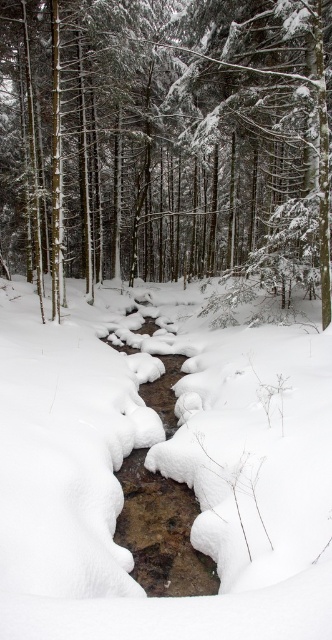
Question: In this image, where is white fluffy snow at center located relative to slick ice stream at center?

Choices:
 (A) left
 (B) right

Answer: (A)

Question: Can you confirm if snow-covered pine tree at center is bigger than slick ice stream at center?

Choices:
 (A) no
 (B) yes

Answer: (B)

Question: Which of the following is the farthest from the observer?

Choices:
 (A) (202, 228)
 (B) (258, 369)

Answer: (A)

Question: Which of these objects is positioned farthest from the slick ice stream at center?

Choices:
 (A) snow-covered pine tree at center
 (B) white fluffy snow at center

Answer: (A)

Question: Is snow-covered pine tree at center below slick ice stream at center?

Choices:
 (A) yes
 (B) no

Answer: (B)

Question: Considering the real-world distances, which object is farthest from the slick ice stream at center?

Choices:
 (A) snow-covered pine tree at center
 (B) white fluffy snow at center

Answer: (A)